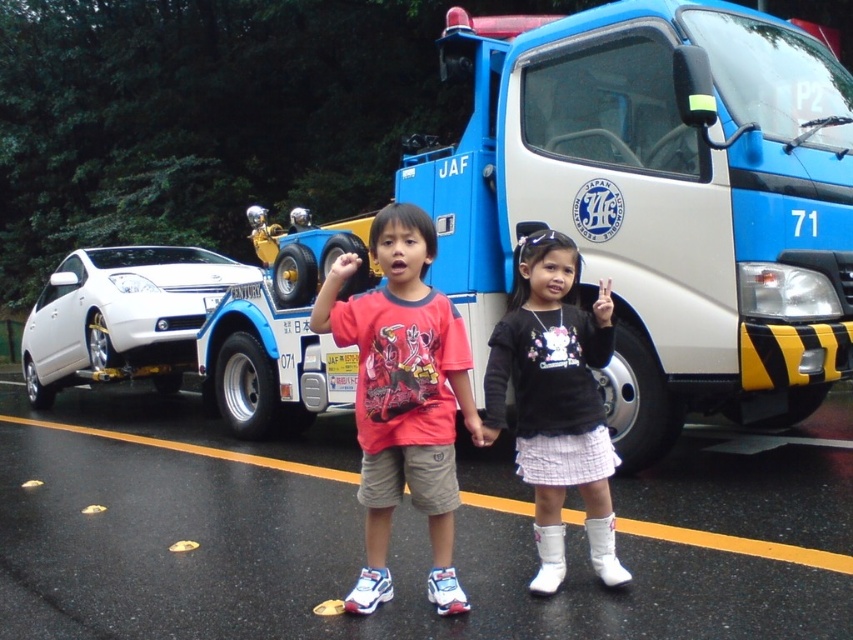
Question: Considering the relative positions of matte red t-shirt at center and white matte boots at lower center in the image provided, where is matte red t-shirt at center located with respect to white matte boots at lower center?

Choices:
 (A) right
 (B) left

Answer: (B)

Question: Is blue metallic tow truck at center to the right of white glossy car at left from the viewer's perspective?

Choices:
 (A) yes
 (B) no

Answer: (A)

Question: Which point is closer to the camera taking this photo?

Choices:
 (A) (140, 330)
 (B) (492, 70)
 (C) (546, 448)

Answer: (C)

Question: Which point is closer to the camera?

Choices:
 (A) matte red t-shirt at center
 (B) white glossy car at left
 (C) blue metallic tow truck at center
 (D) white matte boots at lower center

Answer: (D)

Question: Which object appears farthest from the camera in this image?

Choices:
 (A) blue metallic tow truck at center
 (B) matte red t-shirt at center
 (C) white glossy car at left
 (D) white matte boots at lower center

Answer: (C)

Question: Is matte red t-shirt at center bigger than white glossy car at left?

Choices:
 (A) yes
 (B) no

Answer: (A)